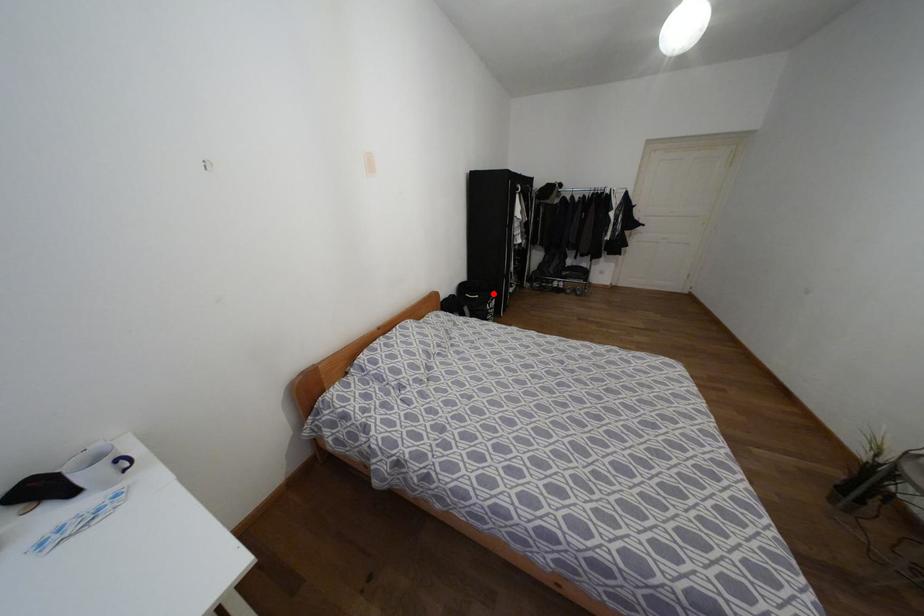
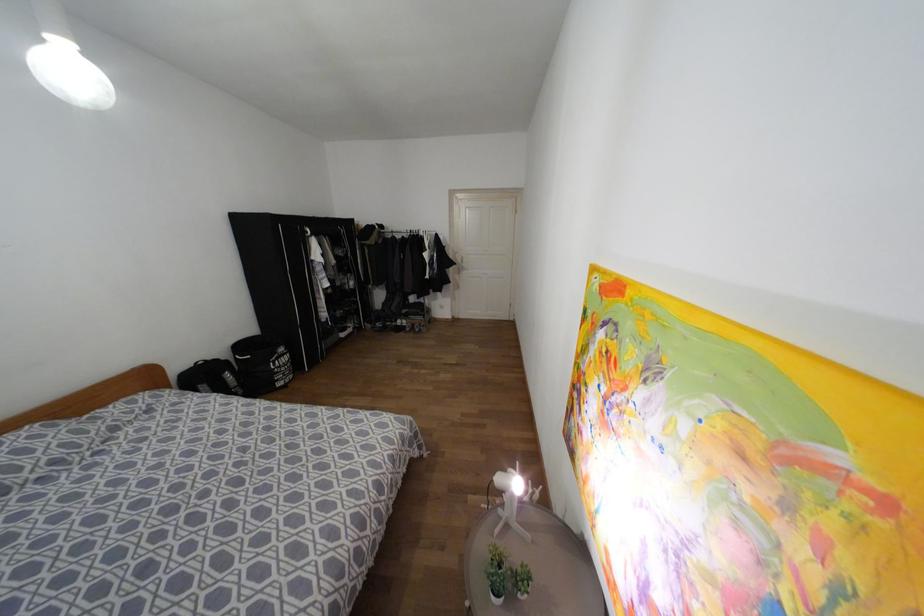
Question: I am providing you with two images of the same scene from different viewpoints. A red point is marked on the first image. Is the red point's position out of view in image 2?

Choices:
 (A) Yes
 (B) No

Answer: (B)